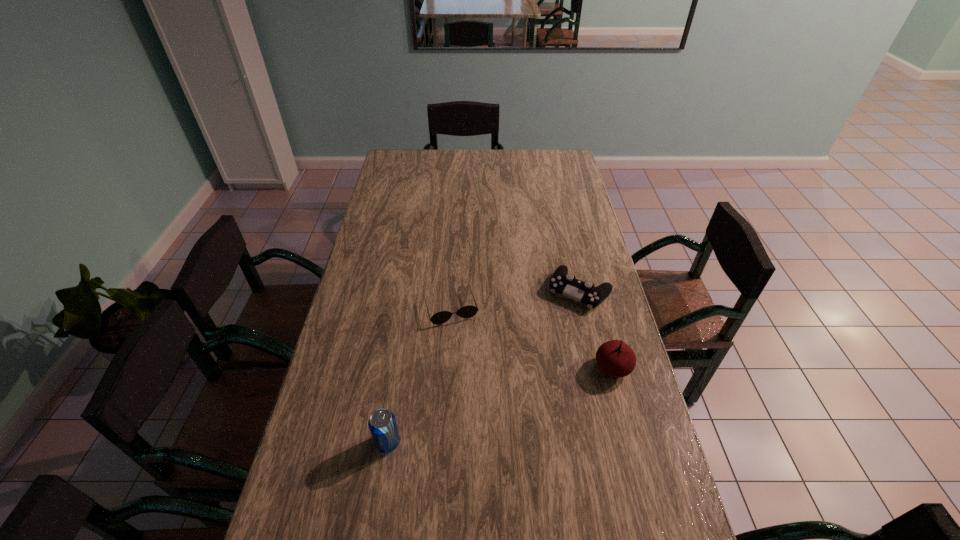
In the image, there is a desktop. Identify the location of vacant area at the far left corner. This screenshot has height=540, width=960. (409, 166).

In the image, there is a desktop. Where is `vacant region at the far right corner`? This screenshot has height=540, width=960. vacant region at the far right corner is located at coordinates (573, 168).

Identify the location of vacant point located between the control and the nearest object. The width and height of the screenshot is (960, 540). (484, 367).

This screenshot has height=540, width=960. I want to click on vacant space in between the control and the tomato, so click(596, 329).

The width and height of the screenshot is (960, 540). I want to click on free space between the shortest object and the control, so click(x=516, y=300).

The image size is (960, 540). What are the coordinates of `vacant space that's between the second tallest object and the third object from right to left` in the screenshot? It's located at pos(532,338).

Find the location of `unoccupied area between the sunglasses and the control`. unoccupied area between the sunglasses and the control is located at coordinates (516, 300).

Where is `free space between the control and the sunglasses`? free space between the control and the sunglasses is located at coordinates (516, 300).

This screenshot has width=960, height=540. In order to click on free space between the beer can and the second nearest object in this screenshot , I will do `click(500, 405)`.

Identify the location of free space between the second object from left to right and the control. This screenshot has height=540, width=960. (516, 300).